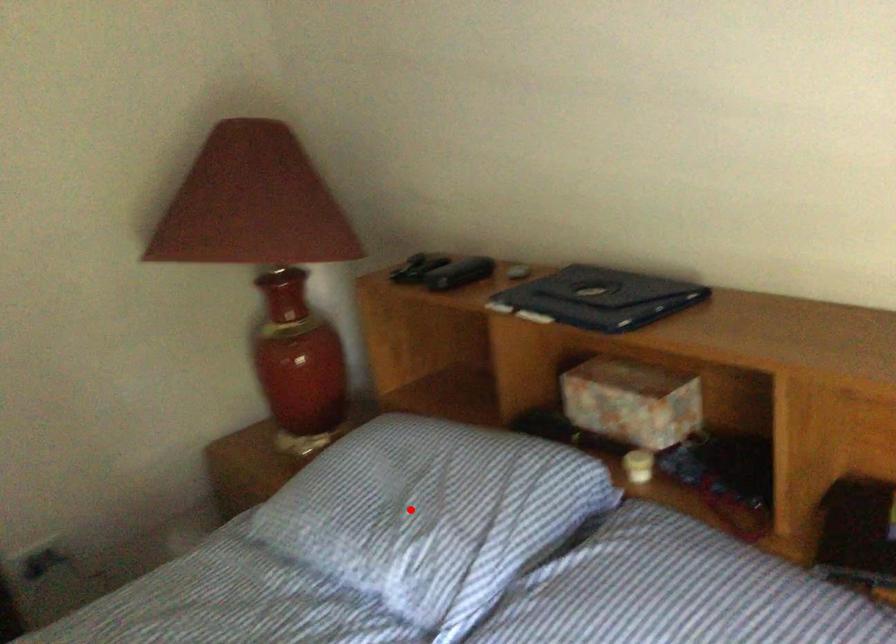
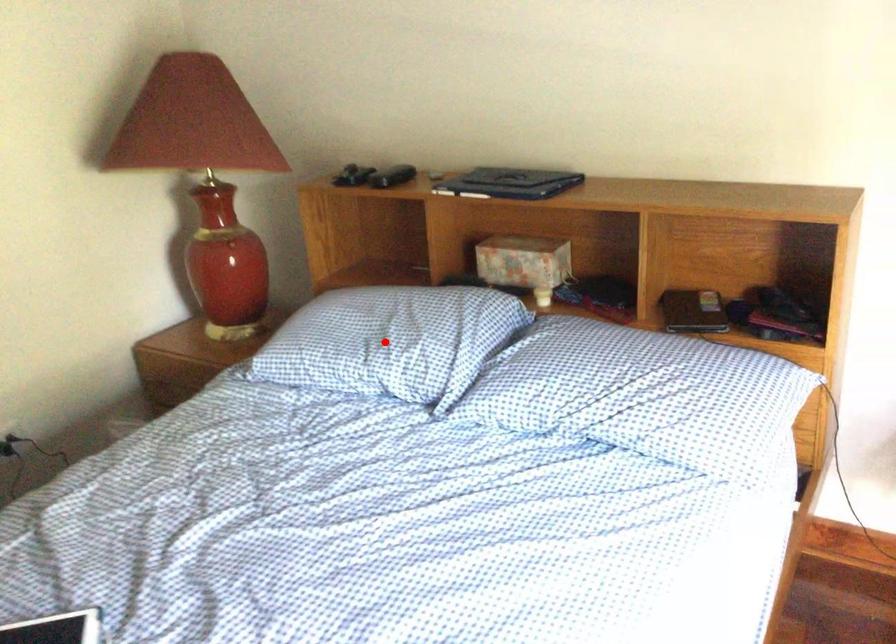
I am providing you with two images of the same scene from different viewpoints. A red point is marked on the first image and another point is marked on the second image. Is the red point in image1 aligned with the point shown in image2?

Yes